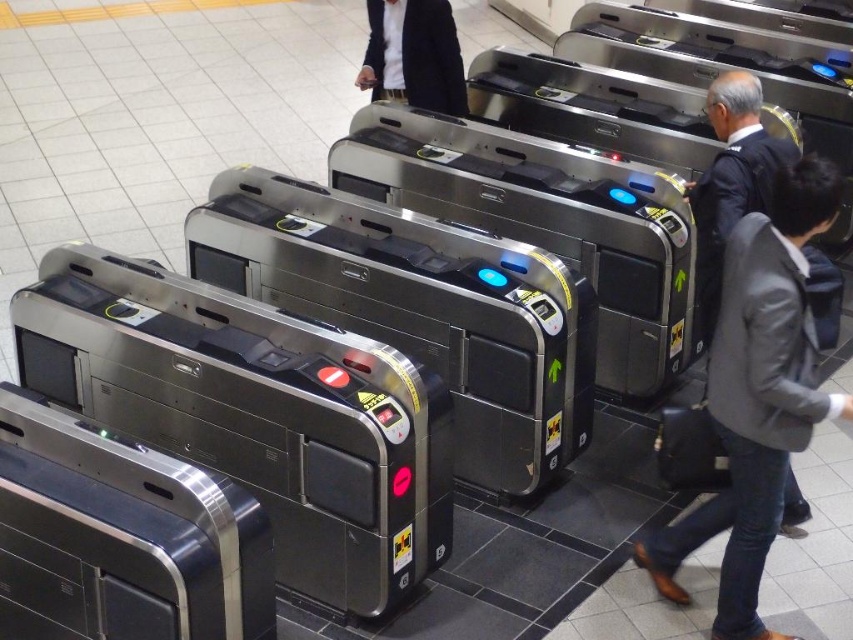
You are a commuter carrying a backpack and need to pass through the turnstile area. There are two items on the right side of the turnstiles, a gray fabric jacket at right and a dark gray suit at right. Which one is closer to the turnstile entrance?

The gray fabric jacket at right is closer to the turnstile entrance because it is only 26.81 inches away from the dark gray suit at right, but without knowing the exact position of the entrance, we cannot determine the distance from the entrance itself. However, since both are on the right side, the jacket being closer to the suit implies it might be nearer to the entrance depending on their arrangement.

You are a passenger holding a ticket and standing at the entrance of the turnstile area. You see the gray fabric jacket at right. Where is the gray fabric jacket located relative to your position?

The gray fabric jacket at right is located at the right side of the turnstile area, specifically at the 2D coordinates point (x=756, y=396).

You are standing at the entrance of the subway station and see two points marked on the turnstile area. The first point is at coordinate point [386,74] and the second is at coordinate point [726,237]. Which point is closer to you?

Answer: Point [386,74] is further to the camera than point [726,237], so the point closer to you is point [726,237].